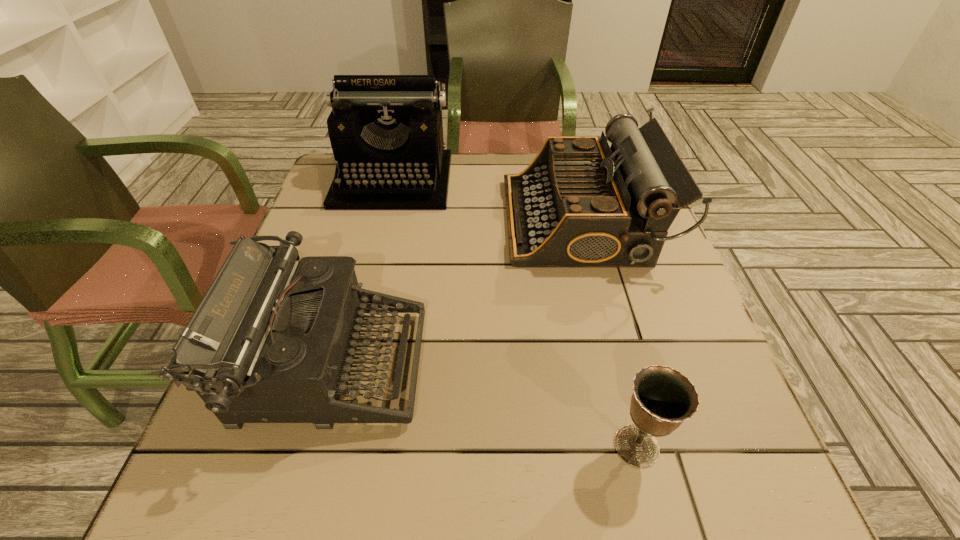
You are a GUI agent. You are given a task and a screenshot of the screen. Output one action in this format:
    pyautogui.click(x=<x>, y=<y>)
    Task: Click on the free region that satisfies the following two spatial constraints: 1. on the back side of the chalice; 2. on the typing side of the nearest typewriter
    Image resolution: width=960 pixels, height=540 pixels.
    Given the screenshot: What is the action you would take?
    pyautogui.click(x=616, y=366)

This screenshot has width=960, height=540. What are the coordinates of `free space that satisfies the following two spatial constraints: 1. on the typing side of the nearest typewriter; 2. on the left side of the shortest object` in the screenshot? It's located at (306, 446).

Find the location of `free region that satisfies the following two spatial constraints: 1. on the typing side of the tallest object; 2. on the typing side of the nearest typewriter`. free region that satisfies the following two spatial constraints: 1. on the typing side of the tallest object; 2. on the typing side of the nearest typewriter is located at coordinates (347, 366).

The image size is (960, 540). In order to click on vacant region that satisfies the following two spatial constraints: 1. on the typing side of the shortest object; 2. on the left side of the tallest object in this screenshot , I will do `click(326, 446)`.

Locate an element on the screen. The height and width of the screenshot is (540, 960). vacant space that satisfies the following two spatial constraints: 1. on the typing side of the tallest object; 2. on the typing side of the nearest typewriter is located at coordinates (347, 366).

Locate an element on the screen. Image resolution: width=960 pixels, height=540 pixels. vacant space that satisfies the following two spatial constraints: 1. on the typing side of the chalice; 2. on the left side of the tallest typewriter is located at coordinates (326, 446).